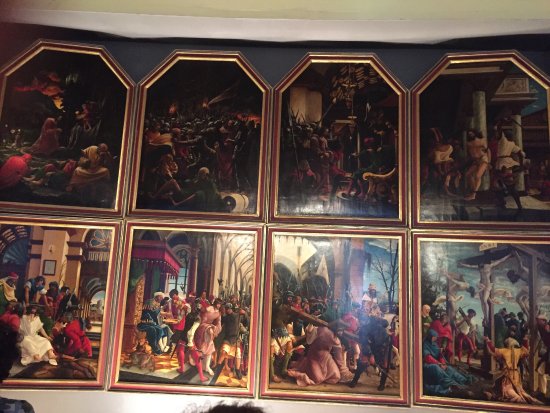
At what (x,y) coordinates should I click in order to perform the action: click on picture. Please return your answer as a coordinate pair (x, y). This screenshot has width=550, height=413. Looking at the image, I should click on (346, 390).